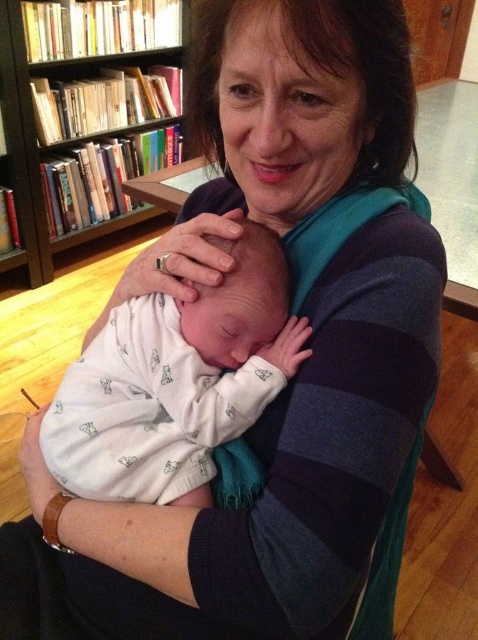
You are a photographer setting up for a family photo shoot in this room. You need to position a large backdrop that is 1.5 meters wide. The backdrop must be placed between the white soft swaddle at center and the wooden bookcase at upper left. Will the space between them be wide enough to accommodate the backdrop?

The white soft swaddle at center has a lesser width compared to wooden bookcase at upper left. However, the question is about the space between them, not their widths. Since the exact distance between them isn not provided in the Objects Description, we cannot determine if the 1.5 meter backdrop will fit. More information is needed.

You are standing in the library and want to place a small gift for the baby that is 12 inches wide. Where should you put it so it is within reach of the baby but not too close to the point at point (246, 417)?

The point at point (246, 417) is 23.17 inches from the viewer. Since the gift is 12 inches wide, placing it between 12 and 23.17 inches away from the viewer would keep it within reach while maintaining a safe distance from the specified point.

You are a photographer setting up for a family photo shoot in this room. You want to ensure the white soft swaddle at center and wooden bookcase at upper left are both visible in the shot. Which object should you position closer to the camera to achieve this?

You should position the white soft swaddle at center closer to the camera since it is already in front of the wooden bookcase at upper left, making it naturally more visible in the frame.